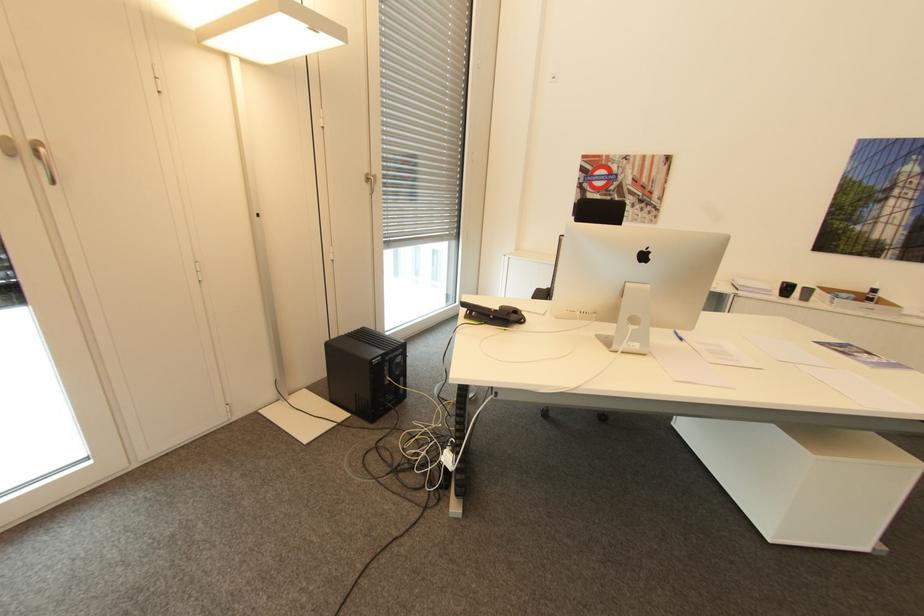
The height and width of the screenshot is (616, 924). Describe the element at coordinates (871, 293) in the screenshot. I see `the small white bottle` at that location.